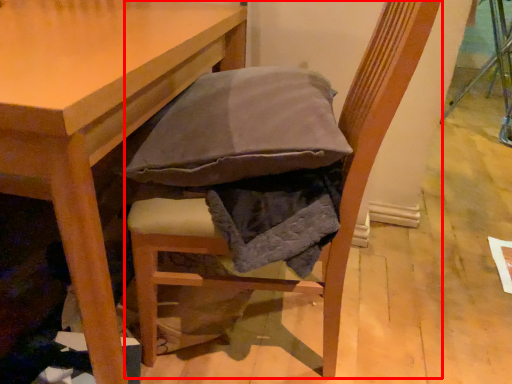
Question: From the image's perspective, what is the correct spatial positioning of chair (annotated by the red box) in reference to table?

Choices:
 (A) below
 (B) above

Answer: (A)